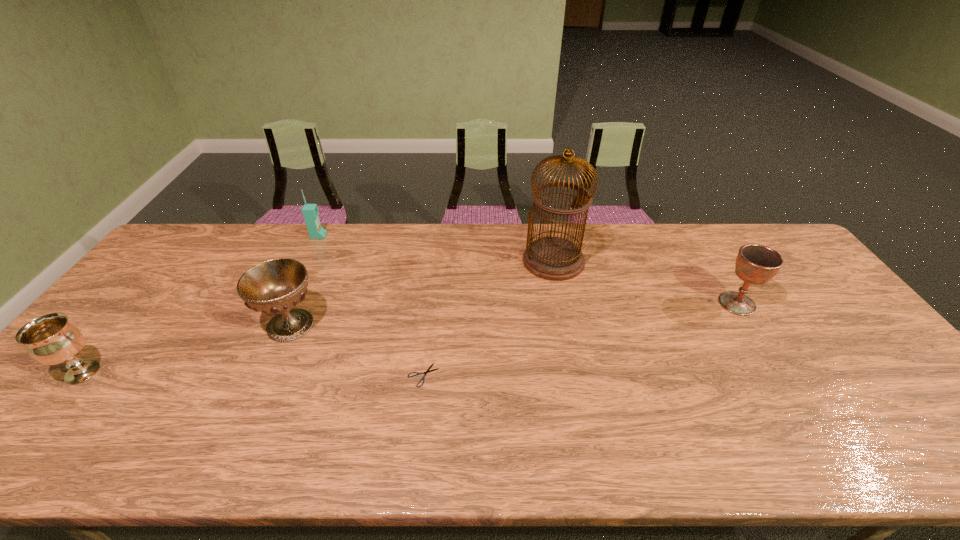
I want to click on free space at the left edge of the desktop, so click(181, 297).

Locate an element on the screen. Image resolution: width=960 pixels, height=540 pixels. vacant space at the right edge of the desktop is located at coordinates (840, 335).

Where is `blank region between the leftmost chalice and the rightmost object`? This screenshot has height=540, width=960. blank region between the leftmost chalice and the rightmost object is located at coordinates (410, 338).

The height and width of the screenshot is (540, 960). Find the location of `vacant area between the second chalice from left to right and the tallest object`. vacant area between the second chalice from left to right and the tallest object is located at coordinates (422, 293).

I want to click on vacant area that lies between the rightmost chalice and the shortest object, so click(580, 339).

Where is `empty space that is in between the nearest chalice and the second chalice from right to left`? The height and width of the screenshot is (540, 960). empty space that is in between the nearest chalice and the second chalice from right to left is located at coordinates (186, 349).

The height and width of the screenshot is (540, 960). What are the coordinates of `vacant space that is in between the second chalice from left to right and the rightmost chalice` in the screenshot? It's located at (514, 314).

The height and width of the screenshot is (540, 960). Identify the location of free spot between the rightmost chalice and the fourth object from left to right. (580, 339).

Locate an element on the screen. This screenshot has height=540, width=960. free area in between the second chalice from left to right and the fourth object from left to right is located at coordinates (357, 350).

Locate an element on the screen. The height and width of the screenshot is (540, 960). the third closest object relative to the farthest object is located at coordinates (418, 373).